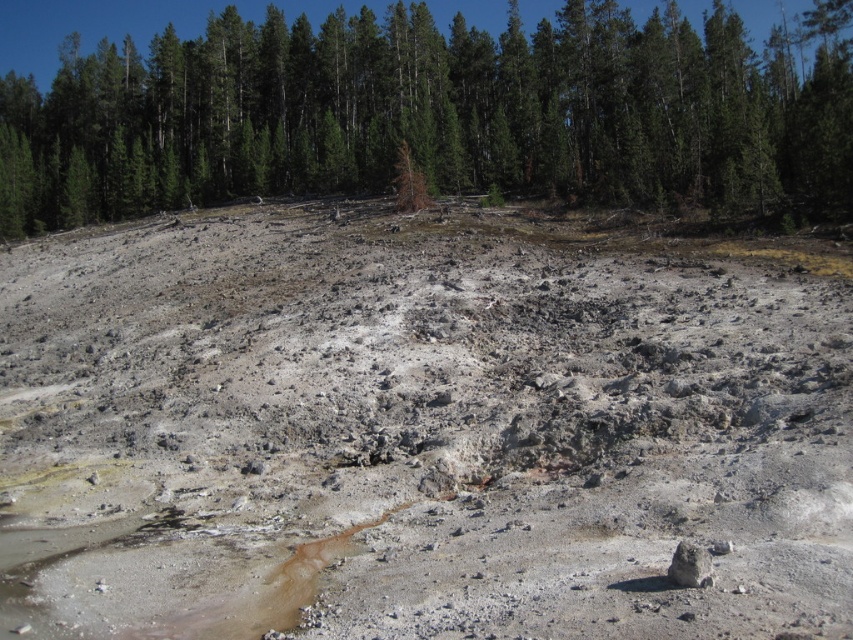
You are a hiker trying to cross the gray rocky hillside at center and the green matte tree at upper center. Which path would you choose if you want to take the narrower route?

You should choose the gray rocky hillside at center because it is thinner than the green matte tree at upper center, making it the narrower path.

You are a hiker trying to navigate through the barren landscape. You see the gray rocky hillside at center and the green matte tree at upper center. Which object is larger in size?

The green matte tree at upper center is larger than the gray rocky hillside at center.